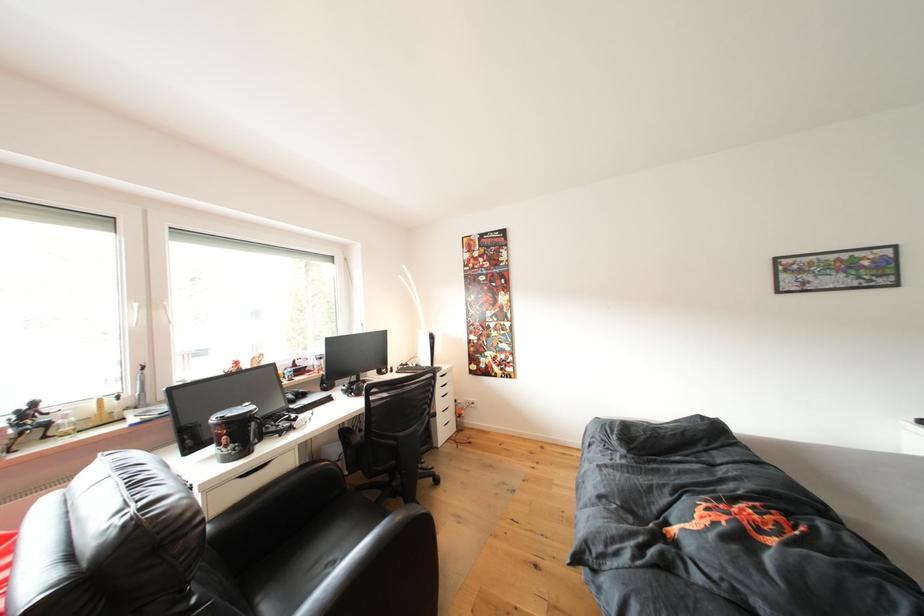
Describe the element at coordinates (383, 572) in the screenshot. I see `the black chair armrest` at that location.